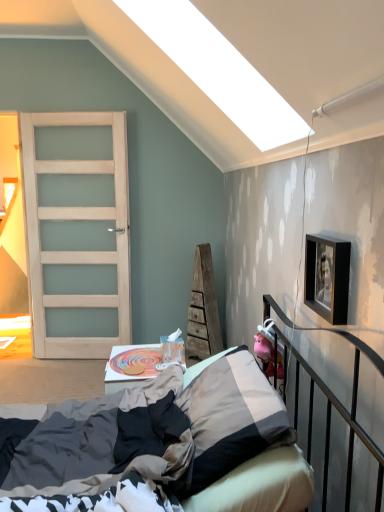
Question: Are textured gray pillow at center and wooden toy at center far apart?

Choices:
 (A) yes
 (B) no

Answer: (B)

Question: Is the depth of textured gray pillow at center greater than that of wooden toy at center?

Choices:
 (A) yes
 (B) no

Answer: (B)

Question: Is textured gray pillow at center not within wooden toy at center?

Choices:
 (A) yes
 (B) no

Answer: (A)

Question: Does textured gray pillow at center have a smaller size compared to wooden toy at center?

Choices:
 (A) yes
 (B) no

Answer: (B)

Question: Considering the relative sizes of textured gray pillow at center and wooden toy at center in the image provided, is textured gray pillow at center bigger than wooden toy at center?

Choices:
 (A) yes
 (B) no

Answer: (A)

Question: Is textured gray pillow at center beside wooden toy at center?

Choices:
 (A) yes
 (B) no

Answer: (B)

Question: Is pink rubber piggy bank at right located outside wooden toy at center?

Choices:
 (A) no
 (B) yes

Answer: (B)

Question: Is pink rubber piggy bank at right placed right next to wooden toy at center?

Choices:
 (A) yes
 (B) no

Answer: (B)

Question: Is pink rubber piggy bank at right at the right side of wooden toy at center?

Choices:
 (A) no
 (B) yes

Answer: (B)

Question: From the image's perspective, does pink rubber piggy bank at right appear higher than wooden toy at center?

Choices:
 (A) no
 (B) yes

Answer: (B)

Question: Can you confirm if pink rubber piggy bank at right is shorter than wooden toy at center?

Choices:
 (A) no
 (B) yes

Answer: (A)

Question: Does pink rubber piggy bank at right lie in front of wooden toy at center?

Choices:
 (A) no
 (B) yes

Answer: (B)

Question: Is textured gray pillow at center completely or partially inside textured beige bed at center?

Choices:
 (A) no
 (B) yes

Answer: (B)